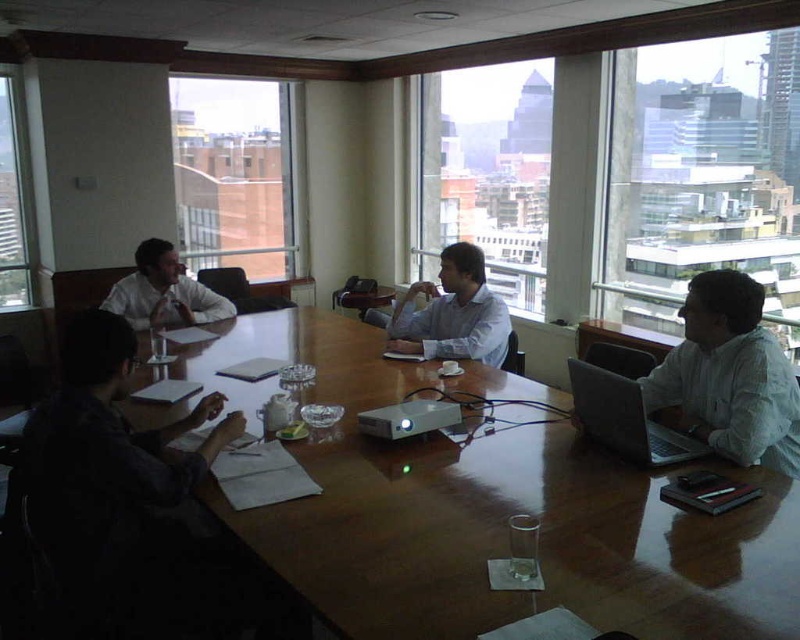
You are an architect reviewing the layout of the meeting room. You need to determine the distance between the brick wall at upper left and the white matte shirt at right for a presentation. Which object is closer to you as you face the image?

The brick wall at upper left is closer to you than the white matte shirt at right because it is further to the viewer, meaning it appears nearer in the image.

You are an interior designer assessing the meeting room. You notice the brick wall at upper left and the white matte shirt at right. Which object is wider in the image?

The brick wall at upper left is wider than the white matte shirt at right according to the description.